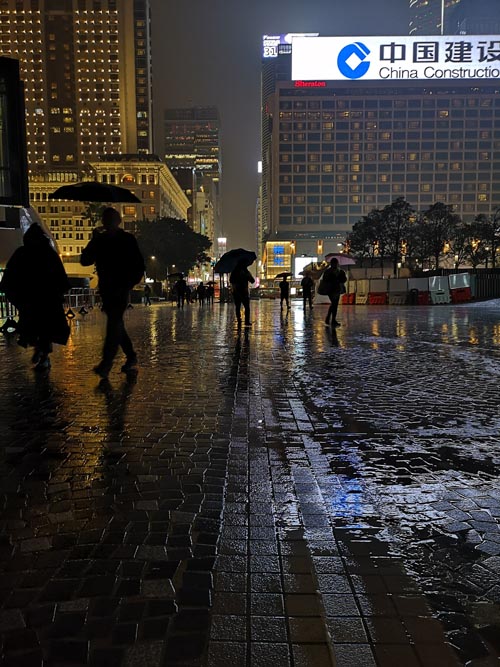
Image resolution: width=500 pixels, height=667 pixels. In order to click on screen in this screenshot , I will do `click(329, 63)`, `click(269, 45)`.